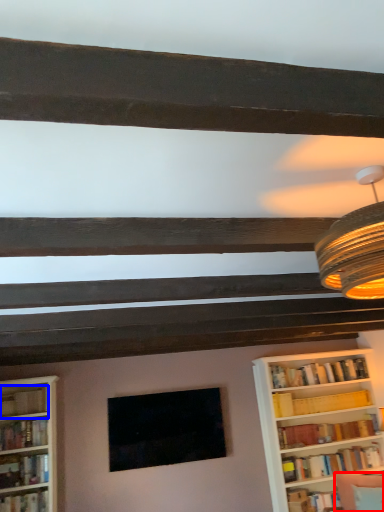
Question: Which object is closer to the camera taking this photo, swivel chair (highlighted by a red box) or book (highlighted by a blue box)?

Choices:
 (A) swivel chair
 (B) book

Answer: (A)